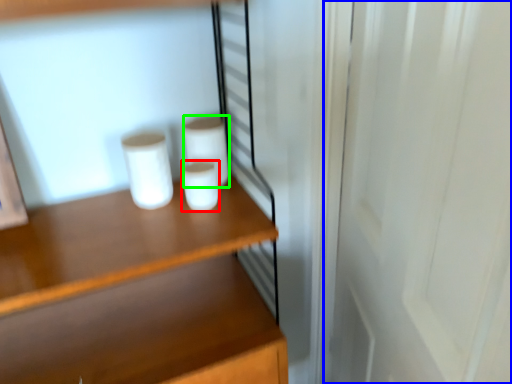
Question: Based on their relative distances, which object is farther from paper towel (highlighted by a red box)? Choose from screen door (highlighted by a blue box) and paper towel (highlighted by a green box).

Choices:
 (A) screen door
 (B) paper towel

Answer: (A)